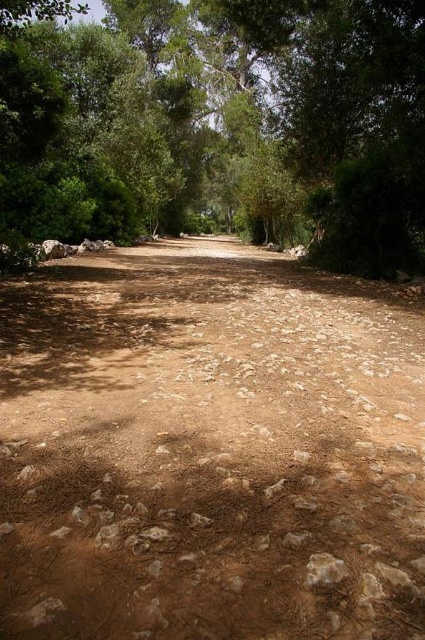
You are a hiker planning to walk along the brown rocky dirt track at center. Based on the coordinates provided, what is the exact location of the track?

The brown rocky dirt track at center is located at coordinates point (207, 449).

From the picture: You are a hiker carrying a backpack and need to cross the brown dirt road at center and the brown rough stone at lower center. Which one is easier to walk on?

The brown dirt road at center is easier to walk on because it has a larger size compared to the brown rough stone at lower center, making it more stable underfoot.